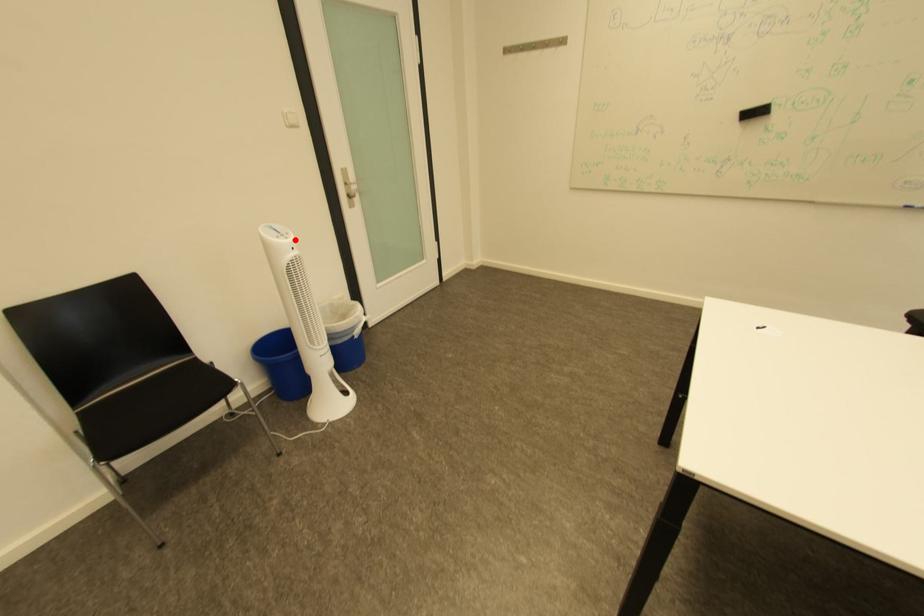
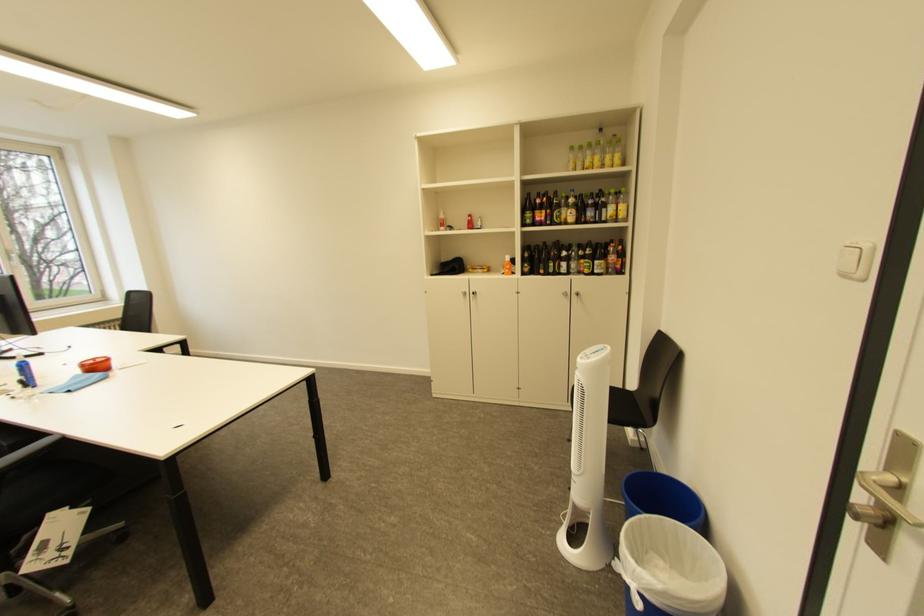
In the second image, find the point that corresponds to the highlighted location in the first image.

(591, 359)